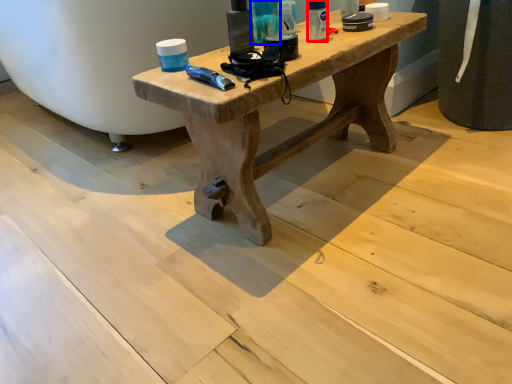
Question: Which object is further to the camera taking this photo, toiletry (highlighted by a red box) or toiletry (highlighted by a blue box)?

Choices:
 (A) toiletry
 (B) toiletry

Answer: (A)